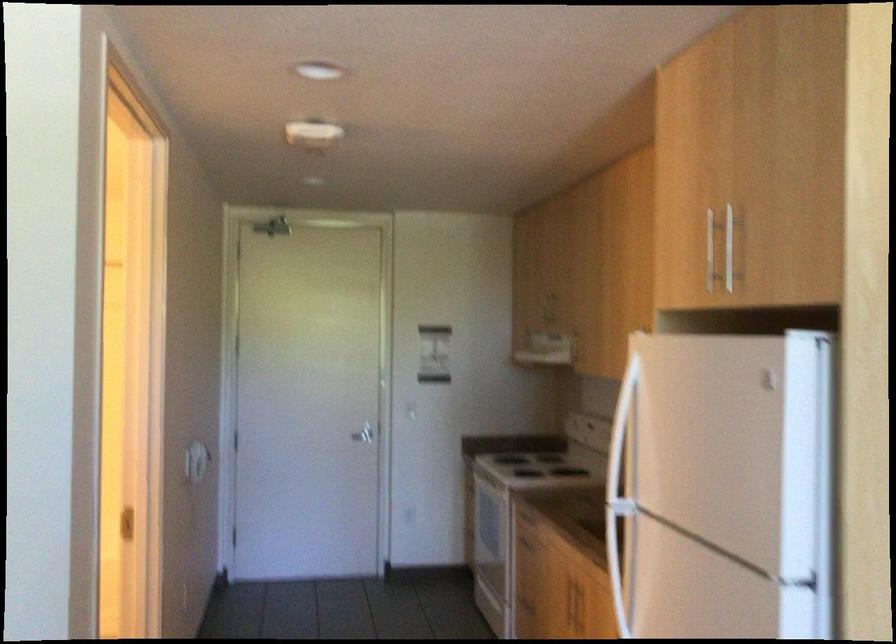
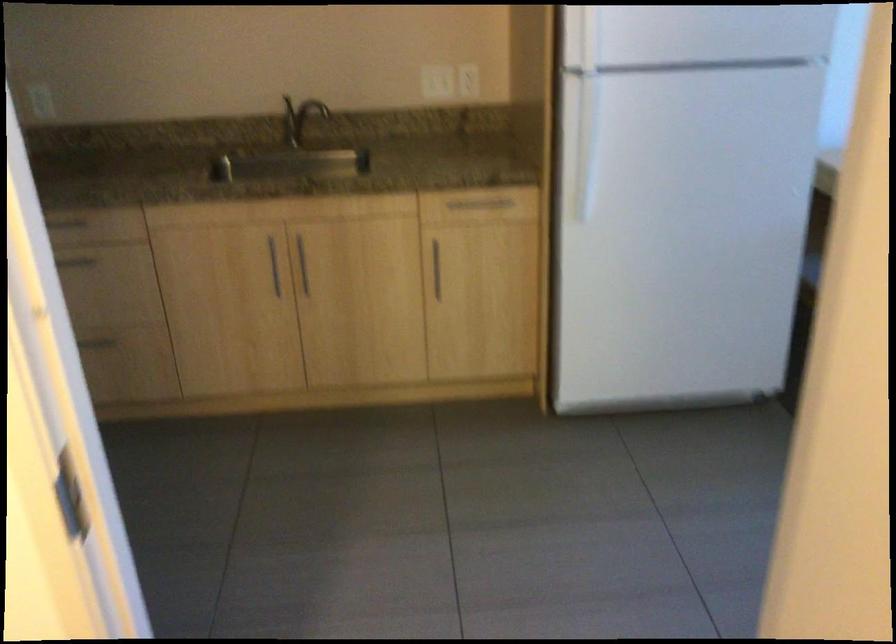
Where in the second image is the point corresponding to (652,448) from the first image?

(581, 39)